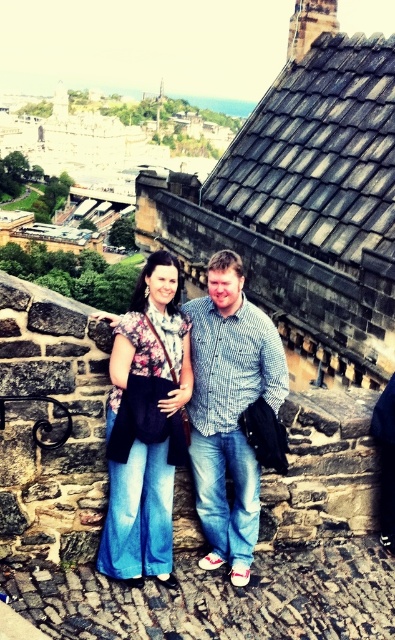
Between point (325, 97) and point (141, 324), which one is positioned behind?

Positioned behind is point (325, 97).

Who is positioned more to the right, gray slate roof at upper center or floral fabric top at center?

gray slate roof at upper center is more to the right.

Which is in front, point (238, 216) or point (174, 417)?

Point (174, 417)

Locate an element on the screen. The width and height of the screenshot is (395, 640). gray slate roof at upper center is located at coordinates (319, 154).

Between gray slate roof at upper center and checkered fabric shirt at center, which one is positioned lower?

checkered fabric shirt at center

Does gray slate roof at upper center have a greater width compared to checkered fabric shirt at center?

Yes, gray slate roof at upper center is wider than checkered fabric shirt at center.

What do you see at coordinates (319, 154) in the screenshot? The height and width of the screenshot is (640, 395). I see `gray slate roof at upper center` at bounding box center [319, 154].

Where is `gray slate roof at upper center`? The image size is (395, 640). gray slate roof at upper center is located at coordinates (319, 154).

Can you confirm if floral fabric top at center is thinner than checkered fabric shirt at center?

Yes.

Can you confirm if floral fabric top at center is wider than checkered fabric shirt at center?

In fact, floral fabric top at center might be narrower than checkered fabric shirt at center.

Where is `floral fabric top at center`? floral fabric top at center is located at coordinates (146, 426).

You are a GUI agent. You are given a task and a screenshot of the screen. Output one action in this format:
    pyautogui.click(x=<x>, y=<y>)
    Task: Click on the floral fabric top at center
    
    Given the screenshot: What is the action you would take?
    pyautogui.click(x=146, y=426)